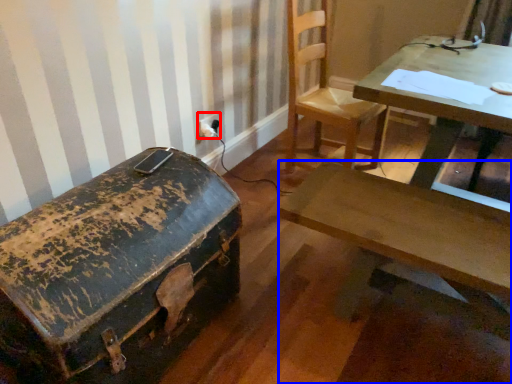
Question: Among these objects, which one is farthest to the camera, electric outlet (highlighted by a red box) or desk (highlighted by a blue box)?

Choices:
 (A) electric outlet
 (B) desk

Answer: (A)